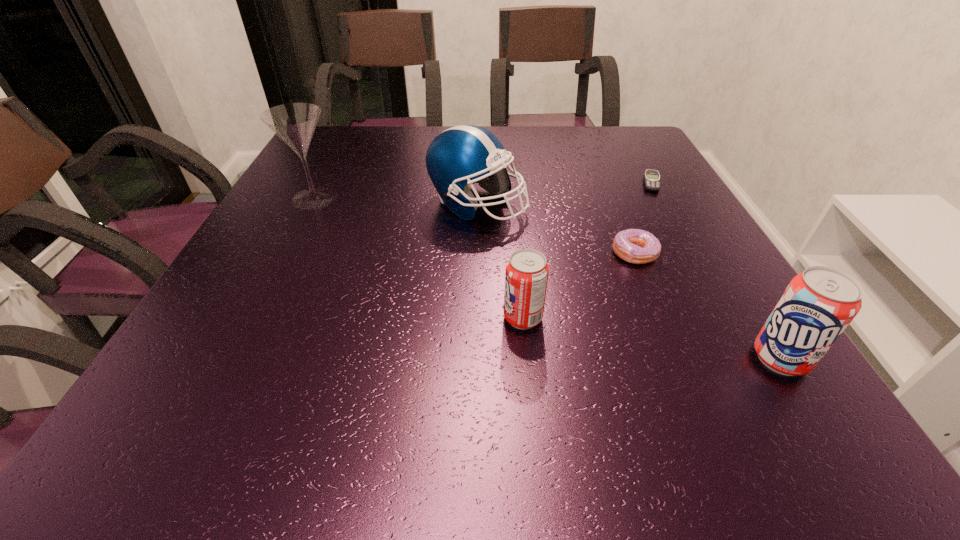
With all soda cans evenly spaced, where should an extra soda can be placed on the left to continue the pattern? Please point out a vacant space. Please provide its 2D coordinates. Your answer should be formatted as a tuple, i.e. [(x, y)], where the tuple contains the x and y coordinates of a point satisfying the conditions above.

[(305, 284)]